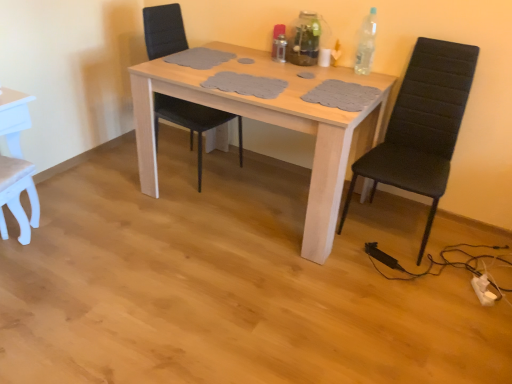
Identify the location of free region under light wood table at center (from a real-world perspective). Image resolution: width=512 pixels, height=384 pixels. (250, 199).